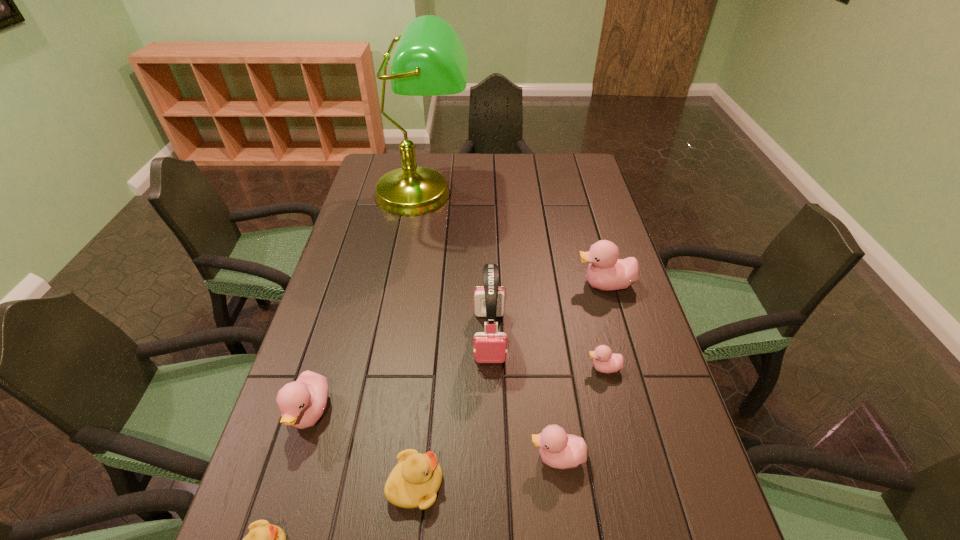
At what (x,y) coordinates should I click in order to perform the action: click on the tallest object. Please return your answer as a coordinate pair (x, y). Image resolution: width=960 pixels, height=540 pixels. Looking at the image, I should click on (430, 60).

The height and width of the screenshot is (540, 960). Identify the location of the farthest object. (430, 60).

Identify the location of the fourth object from right to left. Image resolution: width=960 pixels, height=540 pixels. (490, 346).

This screenshot has height=540, width=960. Find the location of `the seventh shortest object`. the seventh shortest object is located at coordinates (490, 346).

Find the location of a particular element. The image size is (960, 540). the biggest pink duckling is located at coordinates (606, 272).

I want to click on the farthest duckling, so click(x=606, y=272).

The width and height of the screenshot is (960, 540). Find the location of `the fifth shortest object`. the fifth shortest object is located at coordinates (302, 402).

Locate an element on the screen. the leftmost pink duckling is located at coordinates (302, 402).

Identify the location of the fourth duckling from left to right. The image size is (960, 540). (559, 450).

Locate an element on the screen. This screenshot has height=540, width=960. the second pink duckling from left to right is located at coordinates (559, 450).